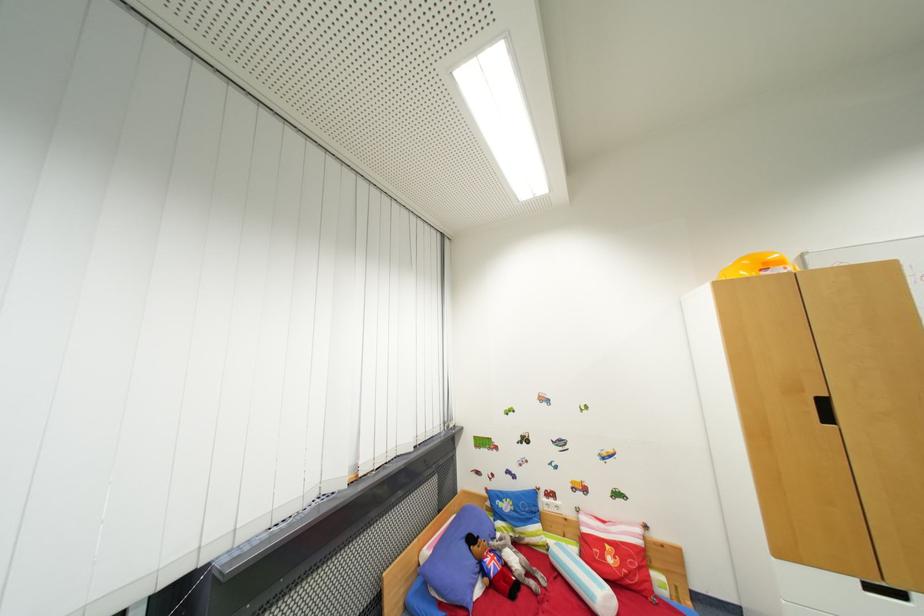
You are a GUI agent. You are given a task and a screenshot of the screen. Output one action in this format:
    pyautogui.click(x=<x>, y=<y>)
    Task: Click on the yellow plastic toy
    Image resolution: width=924 pixels, height=616 pixels.
    Given the screenshot: What is the action you would take?
    pyautogui.click(x=757, y=265)